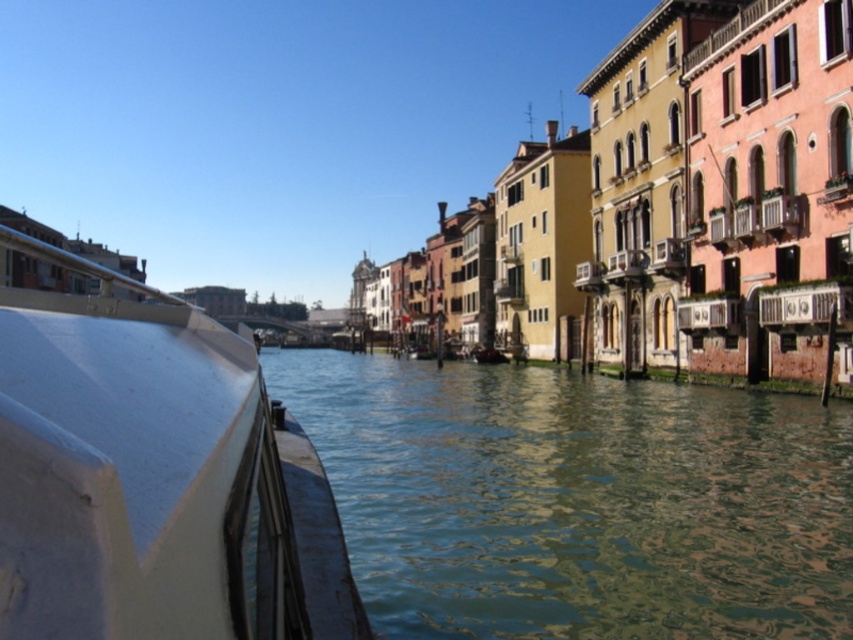
You are an architect designing a new boat that needs to fit within the canal. The boat must be as wide as the white matte boat at left. Can you determine if the greenish water at center has enough width to accommodate your new boat?

The greenish water at center might be wider than the white matte boat at left, so there is a possibility that the water is wide enough to accommodate the new boat. However, since the exact width difference isn not specified, further measurements would be needed to confirm.

You are a tour guide explaining the canal scene to visitors. You mention the greenish water at center and the white matte boat at left. How far apart are these two elements in the image?

The greenish water at center and the white matte boat at left are 92.60 feet apart from each other.

You are standing at point A at the point marked as point (x=763, y=540) in the canal scene. You want to throw a stone to reach point B, which is 206.26 feet away. Considering the serene environment, will the stone make a splash in the water?

The distance between point A at point (x=763, y=540) and point B is 206.26 feet. Since the canal water is calm and reflective, the stone will create a splash when it hits the water surface.